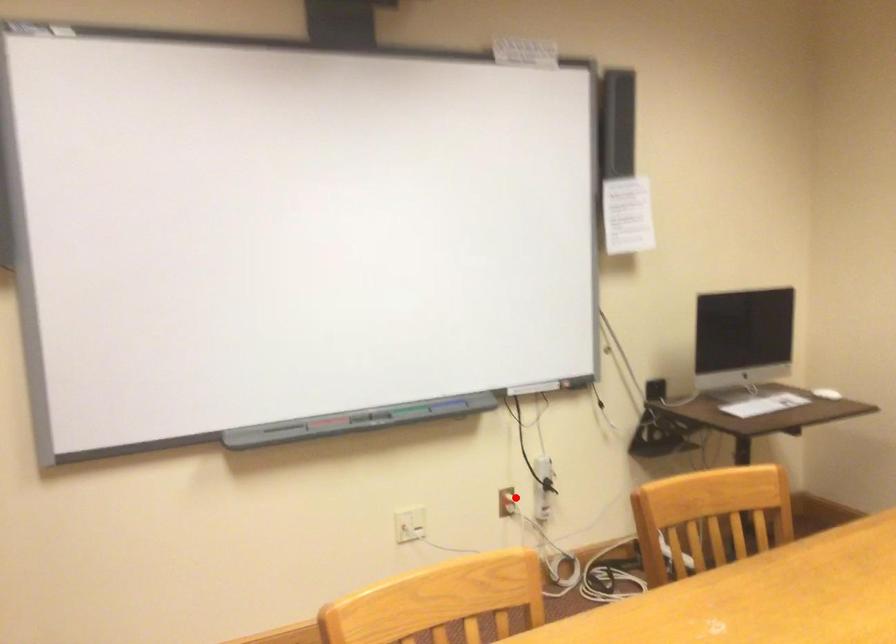
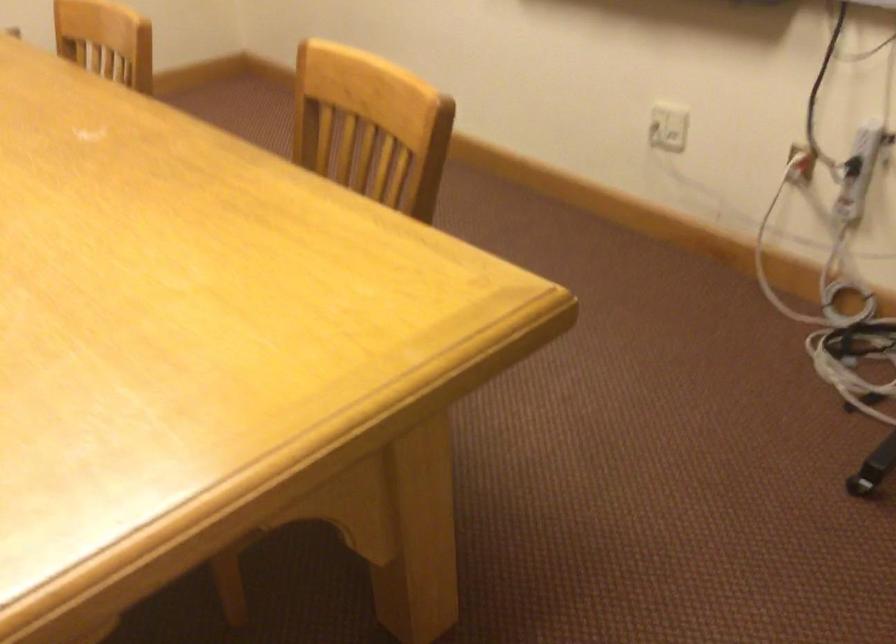
Question: I am providing you with two images of the same scene from different viewpoints. Image1 has a red point marked. In image2, the corresponding 3D location appears at what relative position? Reply with the corresponding letter.

Choices:
 (A) Closer
 (B) Farther

Answer: (A)